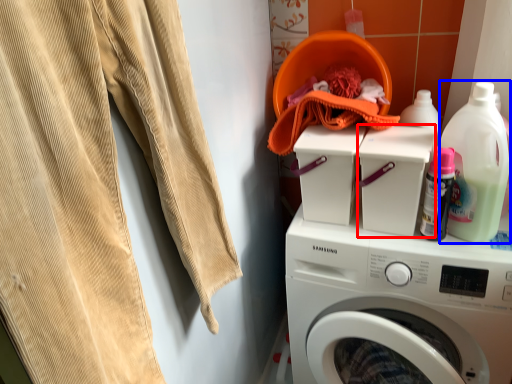
Question: Which of the following is the closest to the observer, appliance (highlighted by a red box) or cleaning product (highlighted by a blue box)?

Choices:
 (A) appliance
 (B) cleaning product

Answer: (B)